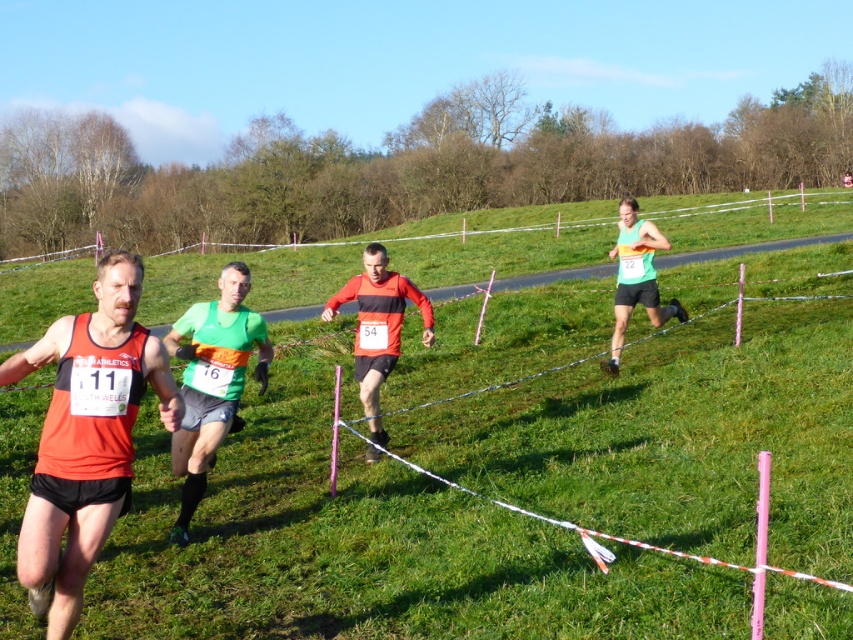
From the picture: Can you confirm if green grassy at center is bigger than matte red running shirt at center?

Indeed, green grassy at center has a larger size compared to matte red running shirt at center.

Where is `green grassy at center`? Image resolution: width=853 pixels, height=640 pixels. green grassy at center is located at coordinates coord(364,541).

Between point (456, 424) and point (374, 250), which one is positioned behind?

Point (456, 424)

Where is `green grassy at center`? green grassy at center is located at coordinates (364, 541).

Between green grassy at center and rainbow jersey runner at right, which one appears on the right side from the viewer's perspective?

Positioned to the right is rainbow jersey runner at right.

Is green grassy at center above rainbow jersey runner at right?

No.

Is point (164, 572) more distant than point (642, 304)?

That is False.

The image size is (853, 640). What are the coordinates of `green grassy at center` in the screenshot? It's located at pos(364,541).

Is green grassy at center to the left of matte orange singlet at left from the viewer's perspective?

In fact, green grassy at center is to the right of matte orange singlet at left.

Which is below, green grassy at center or matte orange singlet at left?

matte orange singlet at left is below.

Find the location of a particular element. The image size is (853, 640). green grassy at center is located at coordinates (364, 541).